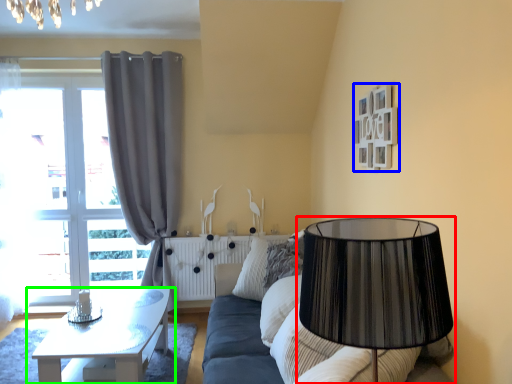
Question: Which object is positioned closest to lamp (highlighted by a red box)? Select from picture frame (highlighted by a blue box) and table (highlighted by a green box).

Choices:
 (A) picture frame
 (B) table

Answer: (A)